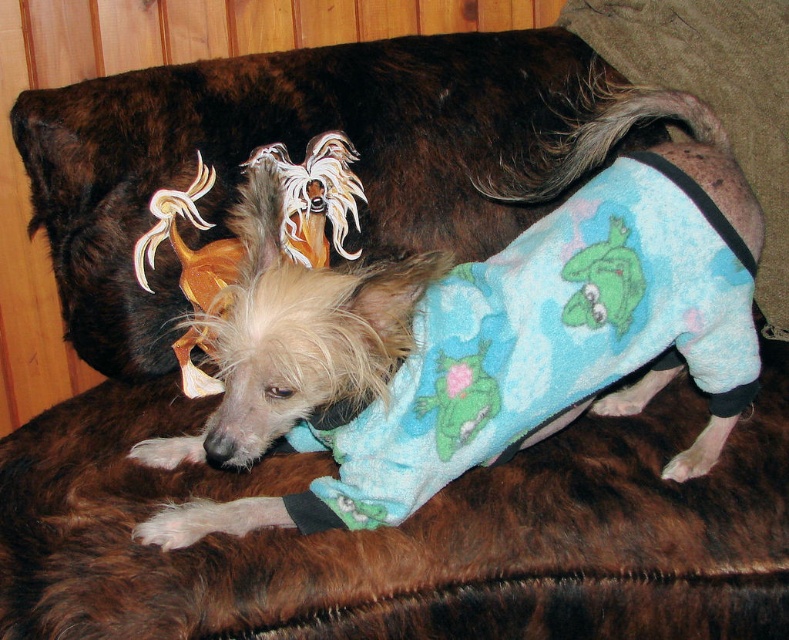
Question: Does blue fleece pajamas at center appear under green plush frog at upper center?

Choices:
 (A) no
 (B) yes

Answer: (B)

Question: Does blue fleece pajamas at center have a lesser width compared to fuzzy blue pajamas at center?

Choices:
 (A) no
 (B) yes

Answer: (A)

Question: From the image, what is the correct spatial relationship of blue fleece pajamas at center in relation to fuzzy blue pajamas at center?

Choices:
 (A) left
 (B) right

Answer: (B)

Question: Which object is the farthest from the blue fleece pajamas at center?

Choices:
 (A) green plush frog at upper center
 (B) fuzzy blue pajamas at center

Answer: (B)

Question: Estimate the real-world distances between objects in this image. Which object is closer to the fuzzy blue pajamas at center?

Choices:
 (A) green plush frog at upper center
 (B) blue fleece pajamas at center

Answer: (B)

Question: Which point is closer to the camera taking this photo?

Choices:
 (A) click(593, 305)
 (B) click(308, 240)
 (C) click(424, 422)

Answer: (C)